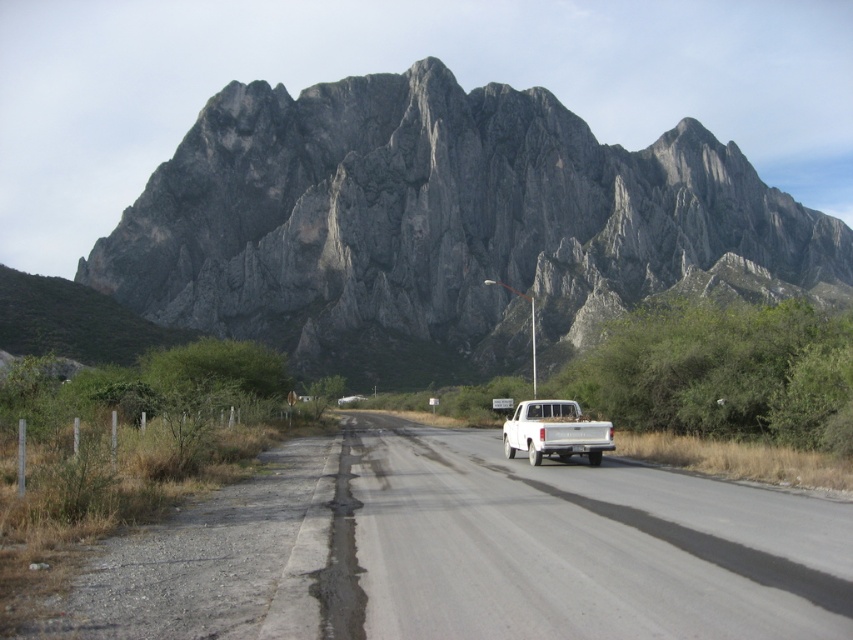
Between white smooth asphalt road at center and white matte truck at center, which one appears on the right side from the viewer's perspective?

From the viewer's perspective, white matte truck at center appears more on the right side.

Who is lower down, white smooth asphalt road at center or white matte truck at center?

white smooth asphalt road at center is below.

Is point (390, 536) positioned in front of point (505, 429)?

Yes, point (390, 536) is in front of point (505, 429).

The image size is (853, 640). I want to click on white smooth asphalt road at center, so click(x=581, y=547).

Does gravelly asphalt road at lower left have a smaller size compared to white matte truck at center?

No.

Is point (213, 596) closer to camera compared to point (596, 452)?

Yes, it is.

Image resolution: width=853 pixels, height=640 pixels. Identify the location of gravelly asphalt road at lower left. (213, 560).

From the picture: Which is more to the right, white smooth asphalt road at center or gravelly asphalt road at lower left?

From the viewer's perspective, white smooth asphalt road at center appears more on the right side.

Who is taller, white smooth asphalt road at center or gravelly asphalt road at lower left?

white smooth asphalt road at center is taller.

Is point (367, 625) positioned in front of point (256, 544)?

Yes.

Where is `white smooth asphalt road at center`? The height and width of the screenshot is (640, 853). white smooth asphalt road at center is located at coordinates (581, 547).